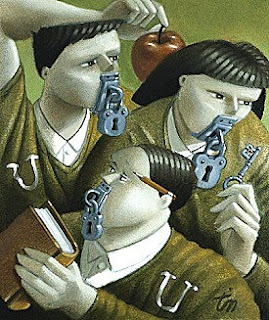
The width and height of the screenshot is (269, 320). Identify the location of book. (36, 232).